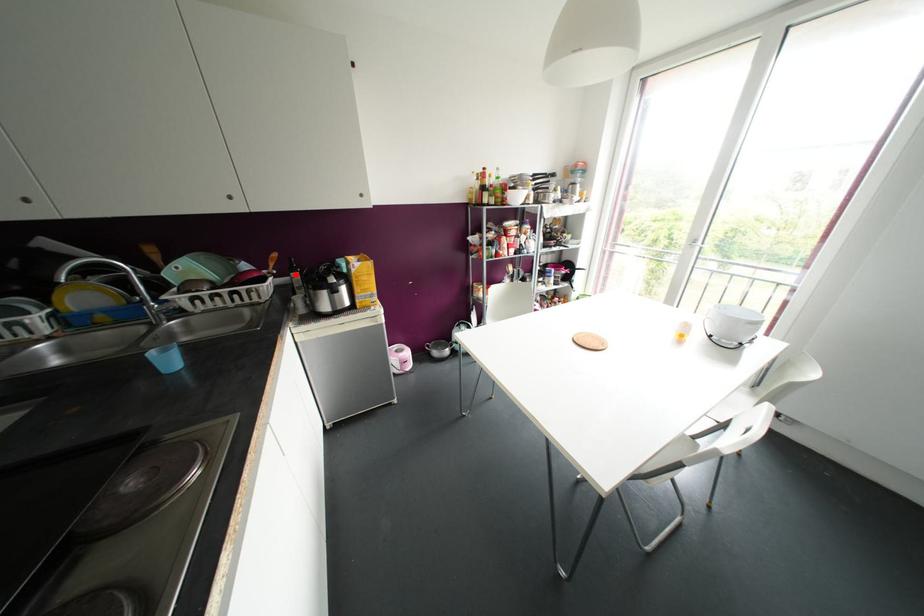
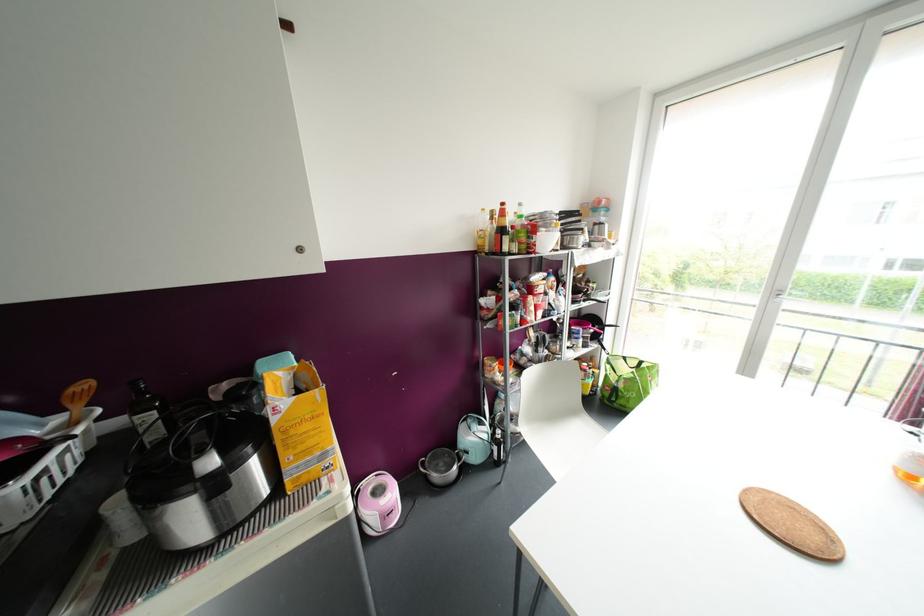
In the second image, find the point that corresponds to the highlighted location in the first image.

(150, 416)